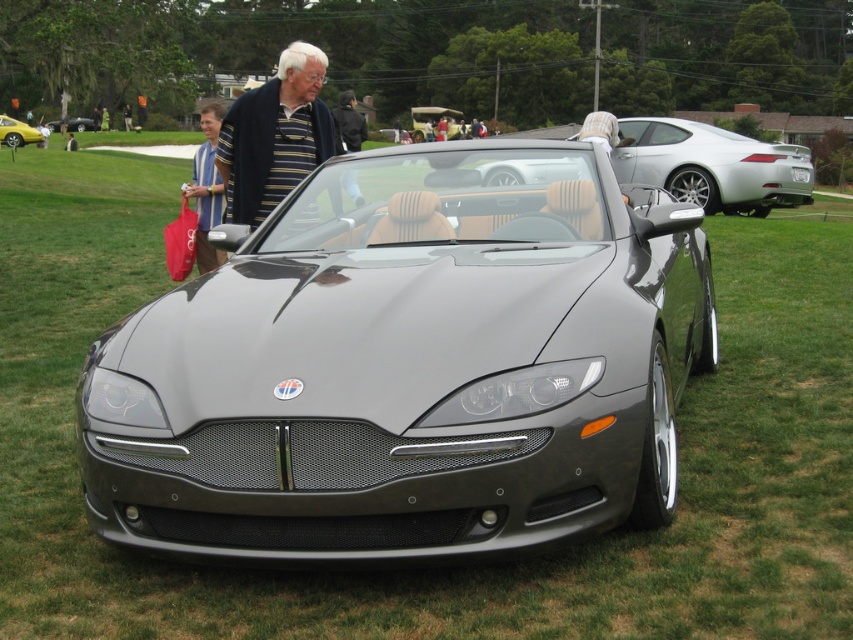
You are a photographer at an outdoor car show. You want to take a photo of the satin silver convertible at center and the matte black convertible at center together in the frame. The minimum distance between the two cars that allows both to be in the same photo without distortion is 150 feet. Can you capture both cars in one shot?

The satin silver convertible at center is 152.09 feet from the matte black convertible at center. Since the required minimum distance is 150 feet, the distance between them is sufficient, so yes, you can capture both cars in one shot without distortion.

You are a photographer at a car show and need to capture a shot of the yellow metallic car at upper left and the matte black convertible at center. According to the scene, which car is on the right side of the other?

The yellow metallic car at upper left is positioned on the right side of matte black convertible at center.